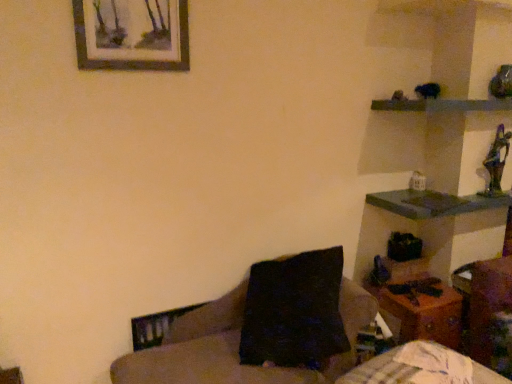
Question: Is wooden shelf at upper right oriented away from wooden table at lower right?

Choices:
 (A) yes
 (B) no

Answer: (B)

Question: Can you see wooden shelf at upper right touching wooden table at lower right?

Choices:
 (A) no
 (B) yes

Answer: (A)

Question: Considering the relative positions of wooden shelf at upper right and wooden table at lower right in the image provided, is wooden shelf at upper right behind wooden table at lower right?

Choices:
 (A) no
 (B) yes

Answer: (A)

Question: Would you say wooden shelf at upper right is a long distance from wooden table at lower right?

Choices:
 (A) no
 (B) yes

Answer: (B)

Question: Does wooden shelf at upper right have a lesser height compared to wooden table at lower right?

Choices:
 (A) yes
 (B) no

Answer: (A)

Question: From the image's perspective, would you say wooden shelf at upper right is positioned over wooden table at lower right?

Choices:
 (A) no
 (B) yes

Answer: (B)

Question: Can you confirm if dark brown fabric couch at center is bigger than wooden picture frame at upper left?

Choices:
 (A) no
 (B) yes

Answer: (B)

Question: From the image's perspective, is dark brown fabric couch at center located above wooden picture frame at upper left?

Choices:
 (A) no
 (B) yes

Answer: (A)

Question: Considering the relative sizes of dark brown fabric couch at center and wooden picture frame at upper left in the image provided, is dark brown fabric couch at center taller than wooden picture frame at upper left?

Choices:
 (A) yes
 (B) no

Answer: (A)

Question: Is the position of dark brown fabric couch at center more distant than that of wooden picture frame at upper left?

Choices:
 (A) no
 (B) yes

Answer: (A)

Question: Can you see dark brown fabric couch at center touching wooden picture frame at upper left?

Choices:
 (A) yes
 (B) no

Answer: (B)

Question: Is dark brown fabric couch at center to the right of wooden picture frame at upper left from the viewer's perspective?

Choices:
 (A) no
 (B) yes

Answer: (B)

Question: Does wooden shelf at upper right contain dark brown fabric couch at center?

Choices:
 (A) yes
 (B) no

Answer: (B)